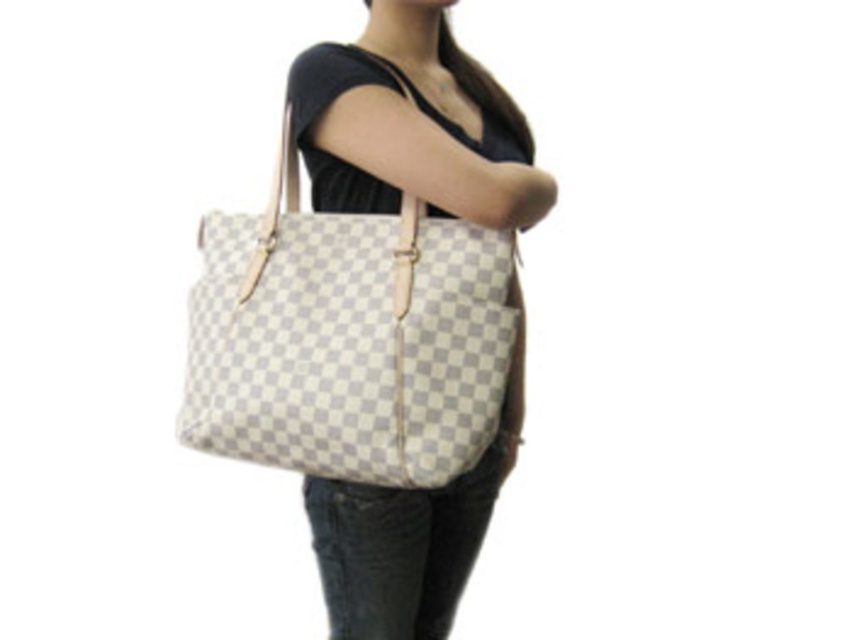
Does white checkered bag at center have a smaller size compared to denim at lower center?

Incorrect, white checkered bag at center is not smaller in size than denim at lower center.

Which is in front, point (419, 122) or point (412, 577)?

Point (419, 122) is in front.

Between point (485, 109) and point (436, 618), which one is positioned behind?

The point (436, 618) is more distant.

The width and height of the screenshot is (852, 640). I want to click on white checkered bag at center, so click(x=412, y=124).

Is point (436, 419) farther from camera compared to point (491, 496)?

No, it is not.

Is point (262, 429) closer to camera compared to point (363, 502)?

Yes, point (262, 429) is in front of point (363, 502).

Identify the location of white checkered fabric tote at center. (347, 339).

Does white checkered fabric tote at center appear on the right side of white checkered bag at center?

In fact, white checkered fabric tote at center is to the left of white checkered bag at center.

Is white checkered fabric tote at center closer to the viewer compared to white checkered bag at center?

No, white checkered fabric tote at center is further to the viewer.

Which is in front, point (422, 333) or point (396, 8)?

Point (422, 333) is in front.

The image size is (852, 640). Find the location of `white checkered fabric tote at center`. white checkered fabric tote at center is located at coordinates (347, 339).